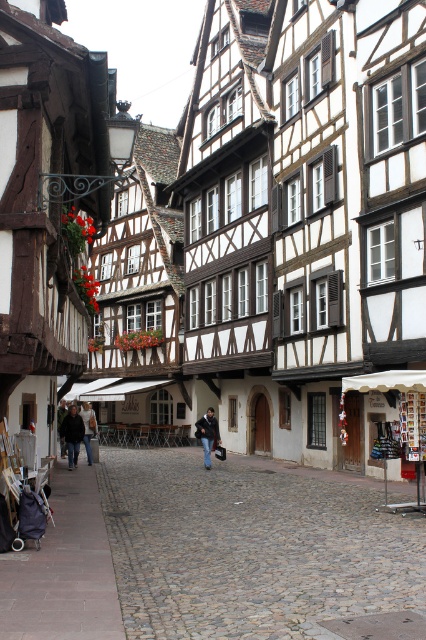
Does cobblestone street at center come in front of dark blue jeans at lower left?

Yes, it is in front of dark blue jeans at lower left.

Can you confirm if cobblestone street at center is positioned below dark blue jeans at lower left?

No, cobblestone street at center is not below dark blue jeans at lower left.

Does point (273, 528) come farther from viewer compared to point (74, 416)?

No, (273, 528) is in front of (74, 416).

This screenshot has width=426, height=640. Identify the location of cobblestone street at center. (218, 550).

Which is below, cobblestone street at center or denim jeans at center?

Positioned lower is denim jeans at center.

Can you confirm if cobblestone street at center is positioned below denim jeans at center?

No, cobblestone street at center is not below denim jeans at center.

This screenshot has height=640, width=426. What are the coordinates of `cobblestone street at center` in the screenshot? It's located at (218, 550).

This screenshot has width=426, height=640. Find the location of `cobblestone street at center`. cobblestone street at center is located at coordinates (218, 550).

Between denim jeans at center and dark gray sweater at center, which one has more height?

Standing taller between the two is denim jeans at center.

Does denim jeans at center appear over dark gray sweater at center?

Actually, denim jeans at center is below dark gray sweater at center.

Who is more forward, (218, 444) or (89, 451)?

Positioned in front is point (89, 451).

I want to click on denim jeans at center, so click(x=207, y=433).